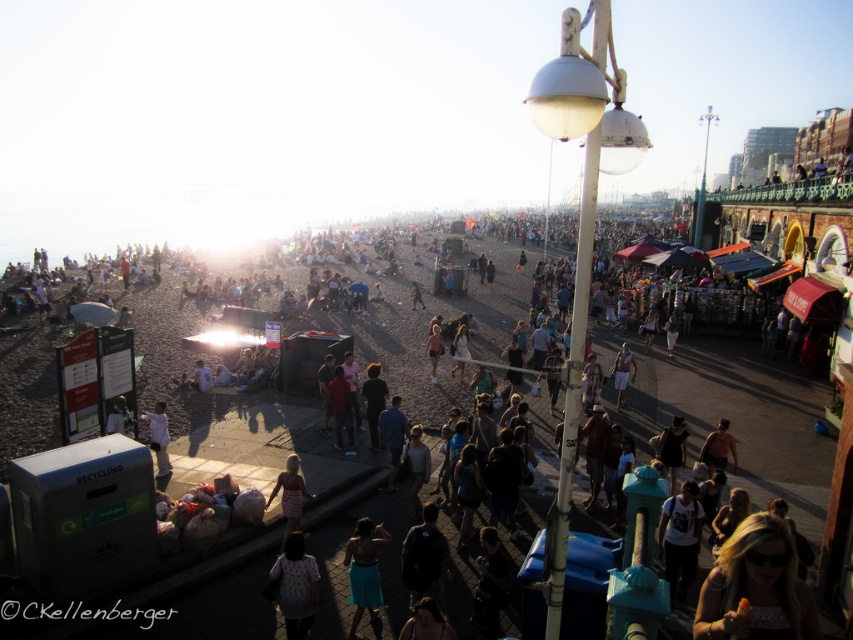
Question: Is the position of white dotted sweater at lower center more distant than that of dark red shirt at center?

Choices:
 (A) no
 (B) yes

Answer: (A)

Question: Considering the relative positions of striped dress at lower center and white cotton shorts at center in the image provided, where is striped dress at lower center located with respect to white cotton shorts at center?

Choices:
 (A) above
 (B) below

Answer: (B)

Question: Is white matte t-shirt at center positioned behind tan skin person at center?

Choices:
 (A) yes
 (B) no

Answer: (B)

Question: Which is nearer to the white matte t-shirt at center?

Choices:
 (A) white dotted sweater at lower center
 (B) blonde hair at lower right
 (C) white cotton shirt at lower left

Answer: (B)

Question: Estimate the real-world distances between objects in this image. Which object is farther from the light brown fabric shirt at lower left?

Choices:
 (A) blue fabric shirt at center
 (B) white cotton shorts at center
 (C) tan skin person at center

Answer: (C)

Question: Which point is farther to the camera?

Choices:
 (A) white dotted sweater at lower center
 (B) blue denim shorts at lower center
 (C) white matte t-shirt at center

Answer: (C)